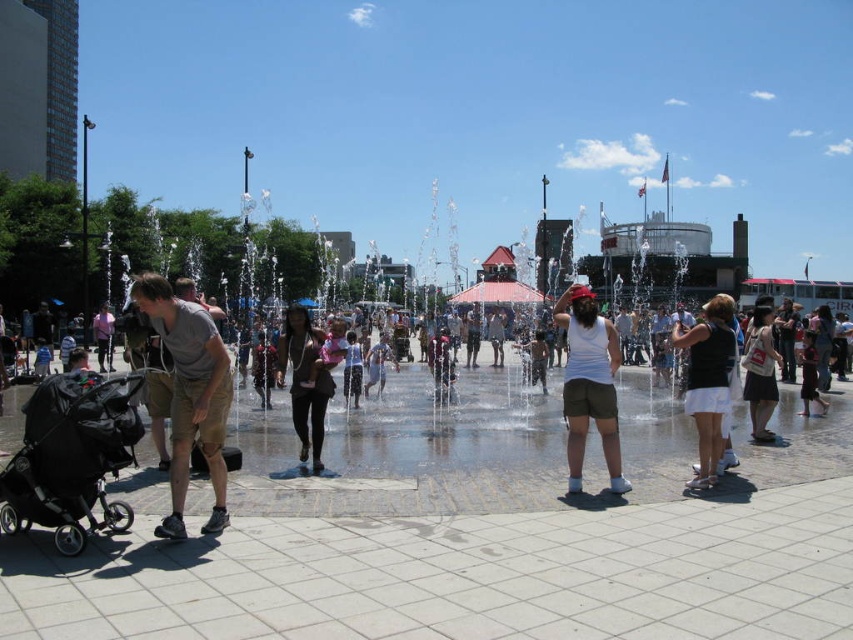
You are a photographer at the plaza and want to capture both the matte black dress at center and the matte black stroller at left in a single frame. Considering their sizes, which object will appear bigger in your photo?

The matte black dress at center will appear bigger in the photo because it is larger in size than the matte black stroller at left.

You are standing in the plaza and want to reach the point marked as point (73, 532). If your walking speed is 1.5 meters per second, how many seconds will it take you to reach that point?

The distance between you and point (73, 532) is 25.72 meters. At a walking speed of 1.5 meters per second, it would take approximately 17.15 seconds to reach the point.